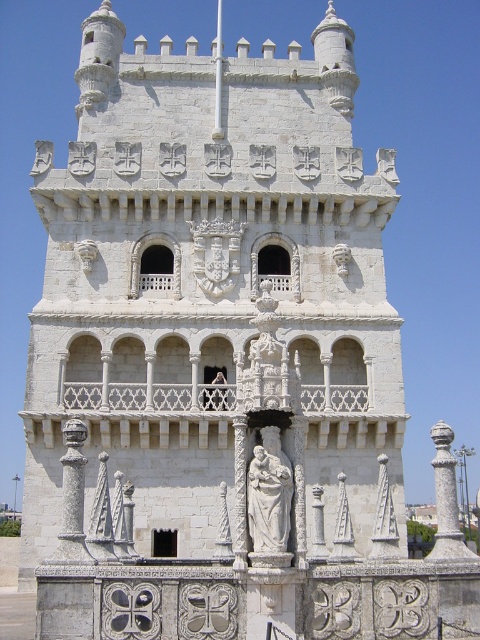
Who is more forward, (271, 515) or (385, 493)?

Point (271, 515) is more forward.

The height and width of the screenshot is (640, 480). Describe the element at coordinates (269, 493) in the screenshot. I see `white marble statue at center` at that location.

You are a GUI agent. You are given a task and a screenshot of the screen. Output one action in this format:
    pyautogui.click(x=<x>, y=<y>)
    Task: Click on the white marble statue at center
    
    Given the screenshot: What is the action you would take?
    pyautogui.click(x=269, y=493)